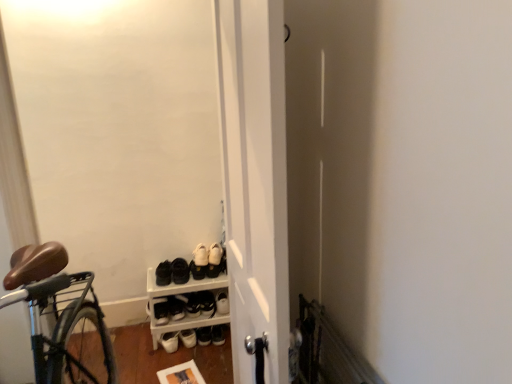
The height and width of the screenshot is (384, 512). In order to click on vacant space to the left of white plastic shoe rack at lower center in this screenshot , I will do `click(124, 338)`.